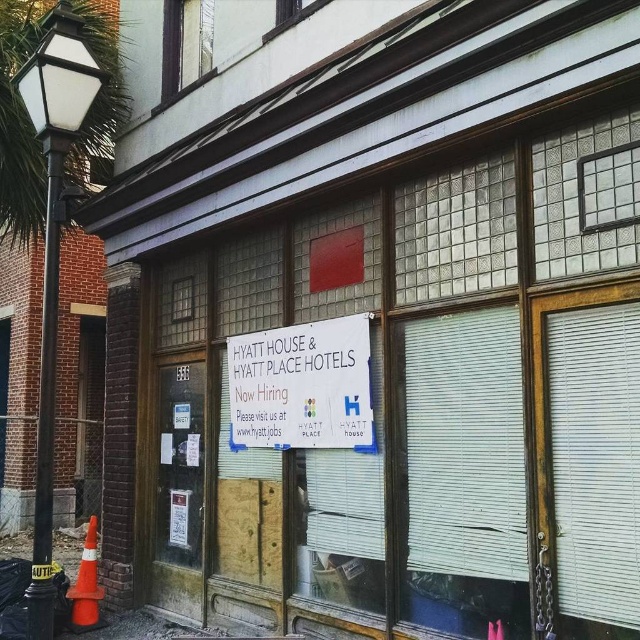
Between white paper sign at center and clear glass window at upper left, which one has more height?

Standing taller between the two is white paper sign at center.

Is white paper sign at center wider than clear glass window at upper left?

Correct, the width of white paper sign at center exceeds that of clear glass window at upper left.

This screenshot has width=640, height=640. Describe the element at coordinates (301, 387) in the screenshot. I see `white paper sign at center` at that location.

The width and height of the screenshot is (640, 640). Find the location of `white paper sign at center`. white paper sign at center is located at coordinates (301, 387).

In the scene shown: Between clear glass window at upper left and clear glass window at upper center, which one has more height?

clear glass window at upper left is taller.

The width and height of the screenshot is (640, 640). Describe the element at coordinates (186, 44) in the screenshot. I see `clear glass window at upper left` at that location.

What do you see at coordinates (186, 44) in the screenshot? This screenshot has width=640, height=640. I see `clear glass window at upper left` at bounding box center [186, 44].

Locate an element on the screen. clear glass window at upper left is located at coordinates point(186,44).

Consider the image. Which of these two, white paper sign at center or clear glass window at upper center, stands taller?

white paper sign at center is taller.

From the picture: Does white paper sign at center lie behind clear glass window at upper center?

No, it is in front of clear glass window at upper center.

In order to click on white paper sign at center in this screenshot , I will do `click(301, 387)`.